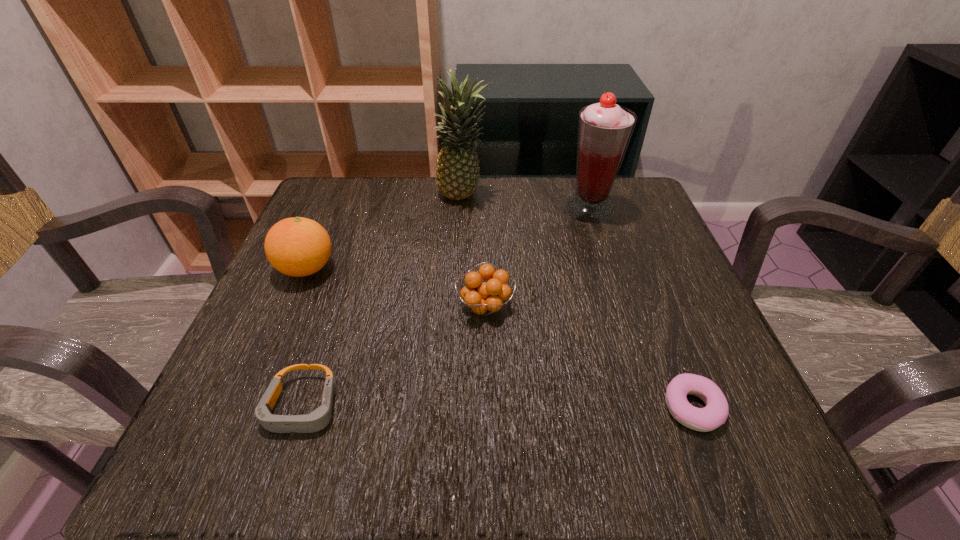
I want to click on free space between the pineapple and the smoothie, so click(526, 203).

You are a GUI agent. You are given a task and a screenshot of the screen. Output one action in this format:
    pyautogui.click(x=<x>, y=<y>)
    Task: Click on the object identified as the closest to the right orange fruit
    
    Given the screenshot: What is the action you would take?
    pyautogui.click(x=317, y=420)

Locate an element on the screen. This screenshot has height=540, width=960. object that is the second closest to the pineapple is located at coordinates (297, 247).

Where is `vacant space that satisfies the following two spatial constraints: 1. on the front side of the smoothie; 2. on the right side of the pineapple`? vacant space that satisfies the following two spatial constraints: 1. on the front side of the smoothie; 2. on the right side of the pineapple is located at coordinates (463, 209).

I want to click on vacant area that satisfies the following two spatial constraints: 1. on the front side of the smoothie; 2. on the left side of the pineapple, so click(x=463, y=209).

Where is `vacant space that satisfies the following two spatial constraints: 1. on the front side of the pineapple; 2. on the left side of the pastry`? The image size is (960, 540). vacant space that satisfies the following two spatial constraints: 1. on the front side of the pineapple; 2. on the left side of the pastry is located at coordinates click(452, 408).

The width and height of the screenshot is (960, 540). Identify the location of vacant space that satisfies the following two spatial constraints: 1. on the front side of the shorter orange fruit; 2. on the left side of the pastry. (487, 408).